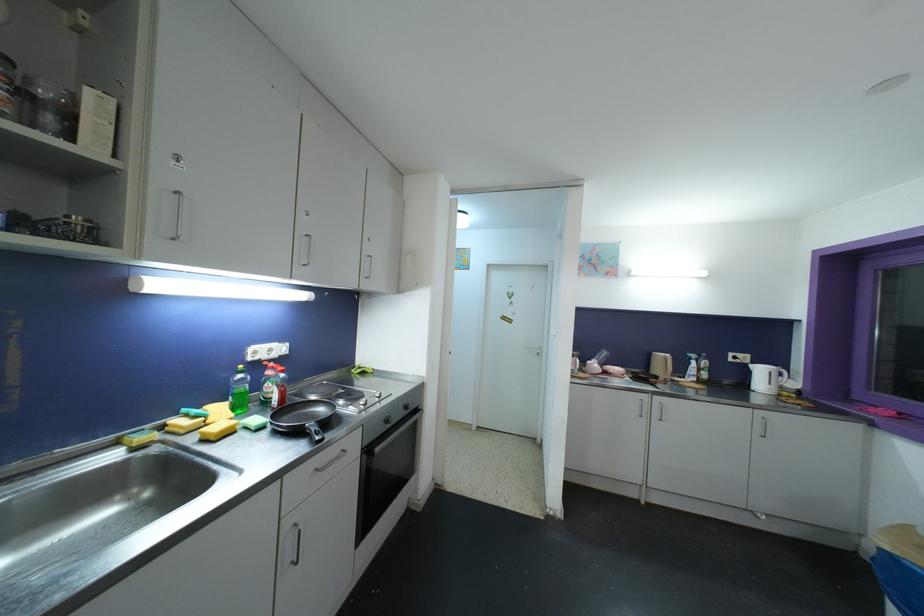
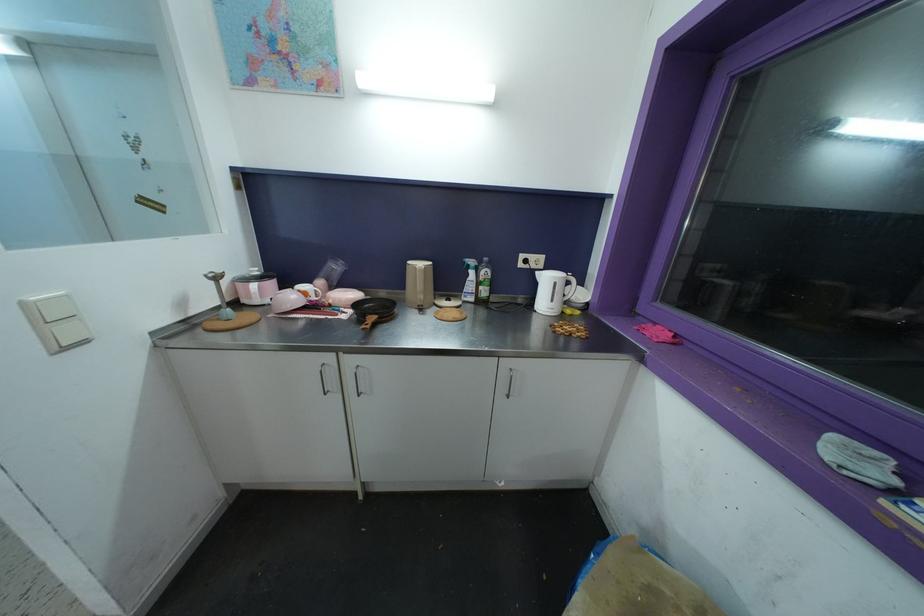
From the picture: The images are taken continuously from a first-person perspective. In which direction are you moving?

The movement direction of the cameraman is right, forward.